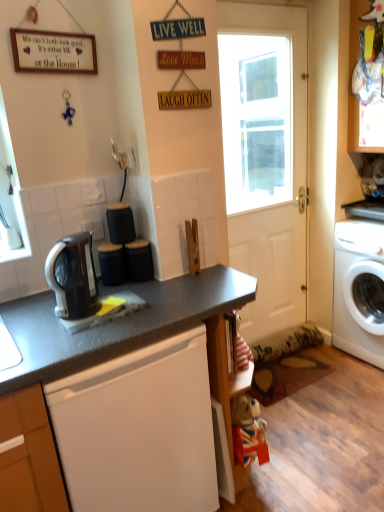
I want to click on free point behind black glossy coffee maker at left, so click(117, 290).